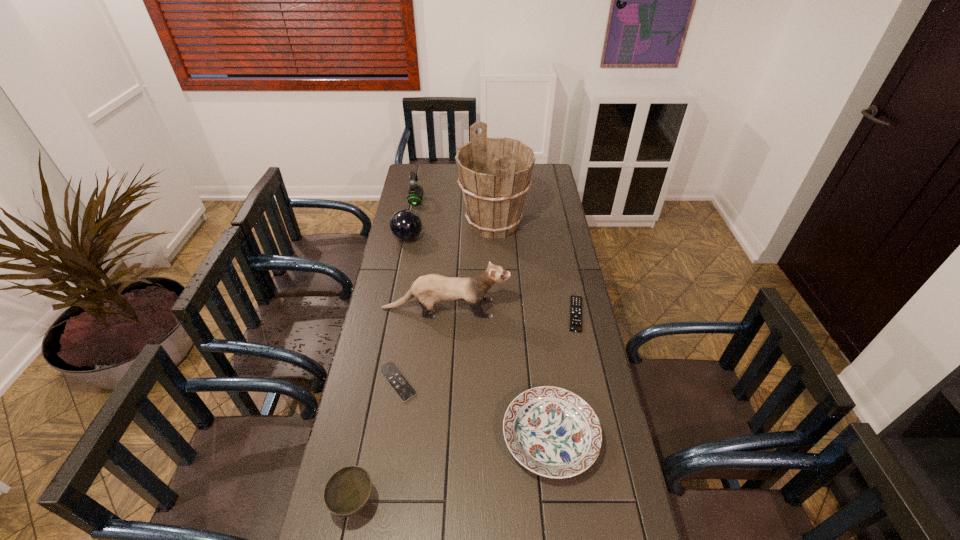
Point out which object is positioned as the sixth nearest to the third shortest object. Please provide its 2D coordinates. Your answer should be formatted as a tuple, i.e. [(x, y)], where the tuple contains the x and y coordinates of a point satisfying the conditions above.

[(405, 224)]

Identify the location of free space that satisfies the following two spatial constraints: 1. on the back side of the taller remote control; 2. on the side of the bowling ball with the finger holes. The height and width of the screenshot is (540, 960). (560, 238).

I want to click on free location that satisfies the following two spatial constraints: 1. on the ear cups of the headset; 2. on the back side of the second shortest object, so pos(395,314).

The image size is (960, 540). What are the coordinates of `blank space that satisfies the following two spatial constraints: 1. on the ear cups of the sixth tallest object; 2. on the left side of the headset` in the screenshot? It's located at (372, 437).

The width and height of the screenshot is (960, 540). Identify the location of vacant point that satisfies the following two spatial constraints: 1. on the ear cups of the headset; 2. on the back side of the right remote control. (395, 314).

Where is `blank area in the image that satisfies the following two spatial constraints: 1. on the back side of the shorter remote control; 2. on the side of the bowling ball with the finger holes`? The width and height of the screenshot is (960, 540). blank area in the image that satisfies the following two spatial constraints: 1. on the back side of the shorter remote control; 2. on the side of the bowling ball with the finger holes is located at coordinates (420, 238).